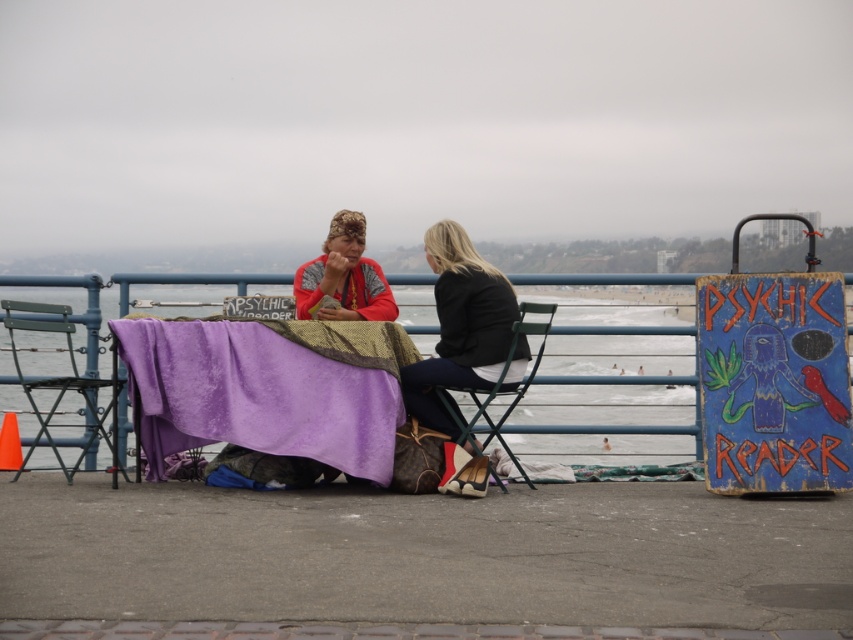
Can you confirm if camouflage fabric headscarf at center is wider than green metal chair at center?

No, camouflage fabric headscarf at center is not wider than green metal chair at center.

Is point (317, 288) positioned after point (502, 486)?

That is True.

The width and height of the screenshot is (853, 640). I want to click on camouflage fabric headscarf at center, so click(x=343, y=276).

Identify the location of camouflage fabric headscarf at center. The image size is (853, 640). (343, 276).

Who is positioned more to the left, purple fabric table at center or black leather jacket at center?

purple fabric table at center is more to the left.

Which is above, purple fabric table at center or black leather jacket at center?

black leather jacket at center is above.

Where is `purple fabric table at center`? purple fabric table at center is located at coordinates (268, 388).

Which of these two, clear blue water at center or green metal chair at center, stands shorter?

With less height is clear blue water at center.

Can you confirm if clear blue water at center is thinner than green metal chair at center?

No.

Is point (142, 278) behind point (523, 474)?

Yes, point (142, 278) is farther from viewer.

Identify the location of clear blue water at center. The image size is (853, 640). (190, 282).